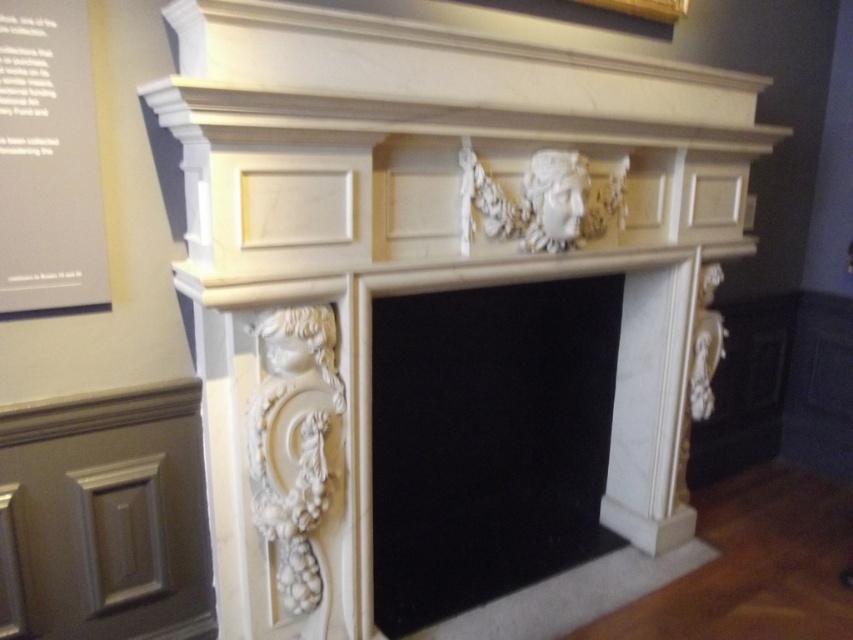
You are standing in front of a classical fireplace mantel. There is a point marked at coordinates (506, 435). Based on the scene description, what object does this point correspond to?

The point corresponds to the white marble fireplace at center.

You are an interior designer assessing the proportions of the white marble fireplace at center and the wooden picture frame at upper center in the image. Which object has a greater height?

The white marble fireplace at center is taller than the wooden picture frame at upper center according to the description.